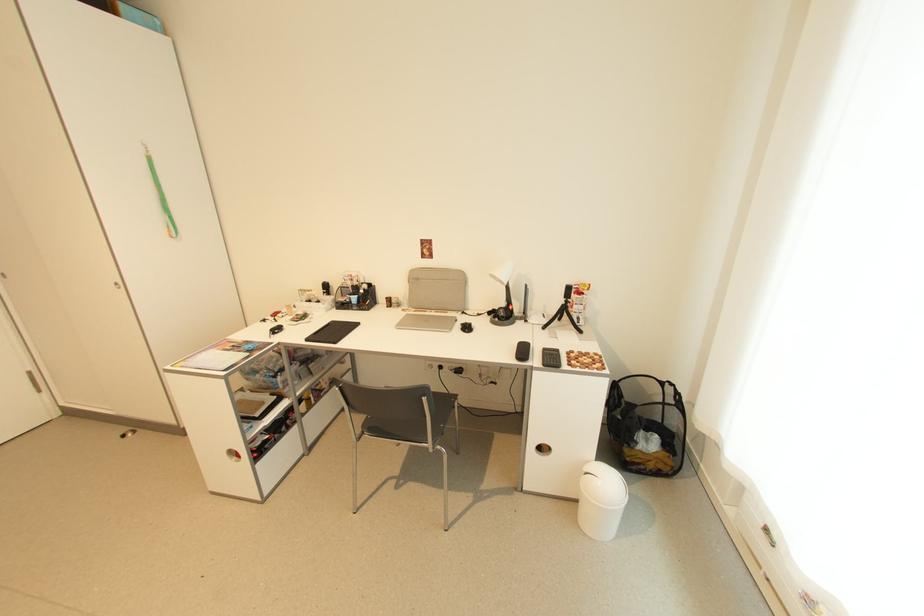
Where is `silver cabinet handle`? silver cabinet handle is located at coordinates (233, 455).